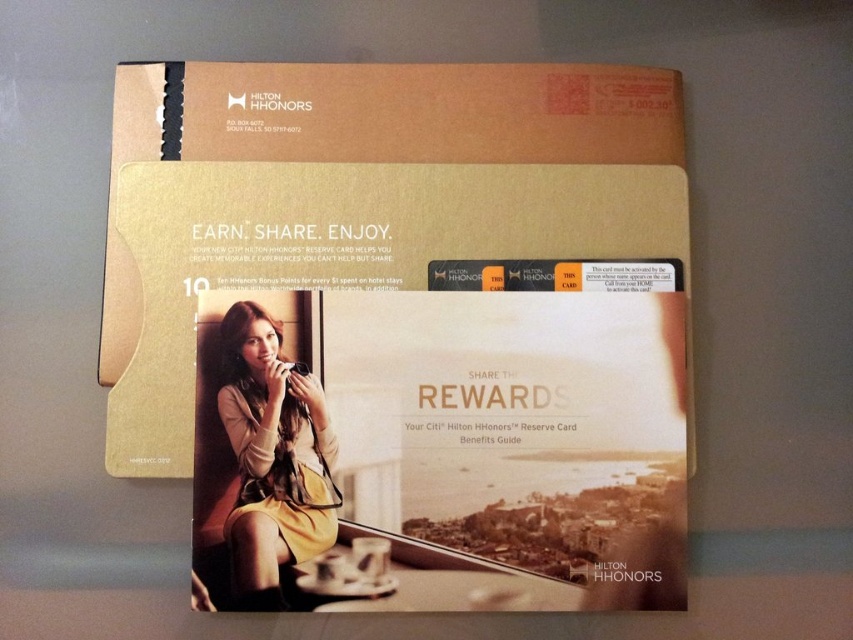
Does gold cardboard box at center appear on the right side of yellow fabric dress at center?

Indeed, gold cardboard box at center is positioned on the right side of yellow fabric dress at center.

Does gold cardboard box at center appear over yellow fabric dress at center?

Correct, gold cardboard box at center is located above yellow fabric dress at center.

Does point (181, 140) lie behind point (271, 342)?

Yes, it is.

I want to click on gold cardboard box at center, so click(415, 333).